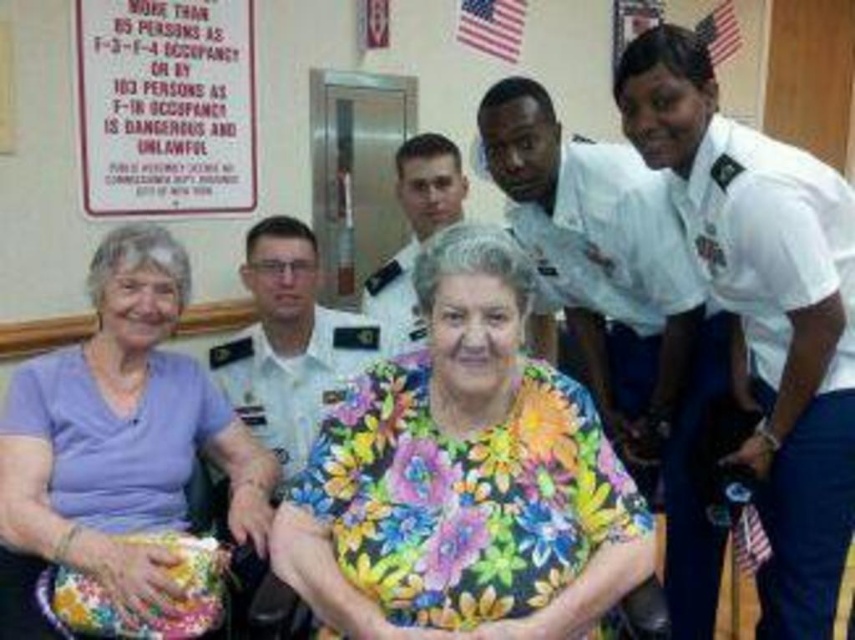
Between floral fabric shirt at center and white uniform at center, which one appears on the right side from the viewer's perspective?

From the viewer's perspective, white uniform at center appears more on the right side.

Measure the distance between floral fabric shirt at center and camera.

They are 5.22 feet apart.

Which is behind, point (313, 545) or point (792, 164)?

The point (792, 164) is behind.

The width and height of the screenshot is (855, 640). In order to click on floral fabric shirt at center in this screenshot , I will do `click(463, 477)`.

Is white uniform at center below white uniform at upper right?

Incorrect, white uniform at center is not positioned below white uniform at upper right.

Is white uniform at center positioned at the back of white uniform at upper right?

No, white uniform at center is in front of white uniform at upper right.

The image size is (855, 640). Identify the location of white uniform at center. (765, 308).

Is point (793, 339) more distant than point (425, 209)?

No, (793, 339) is in front of (425, 209).

Is white uniform at center above white uniform shirt at center?

Actually, white uniform at center is below white uniform shirt at center.

Find the location of `white uniform at center`. white uniform at center is located at coordinates (765, 308).